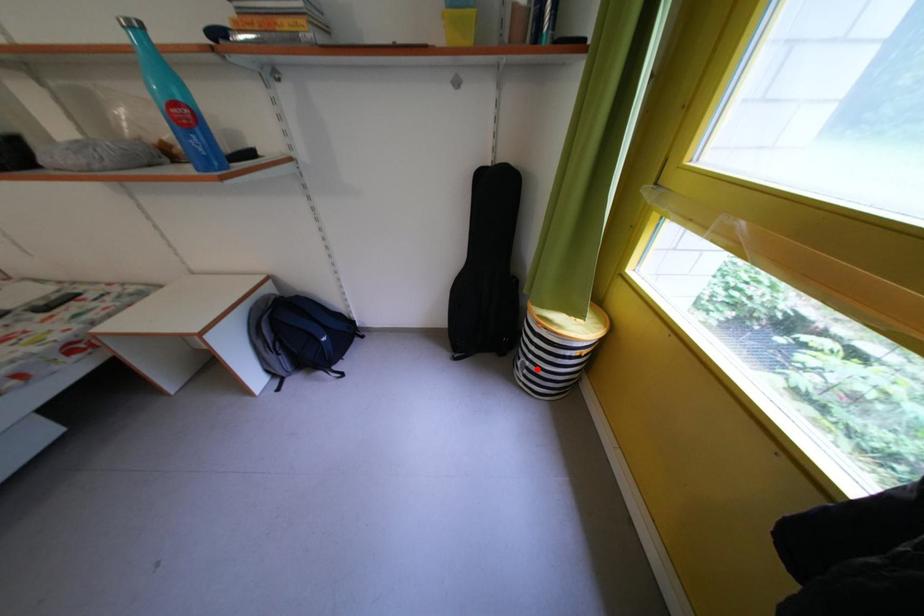
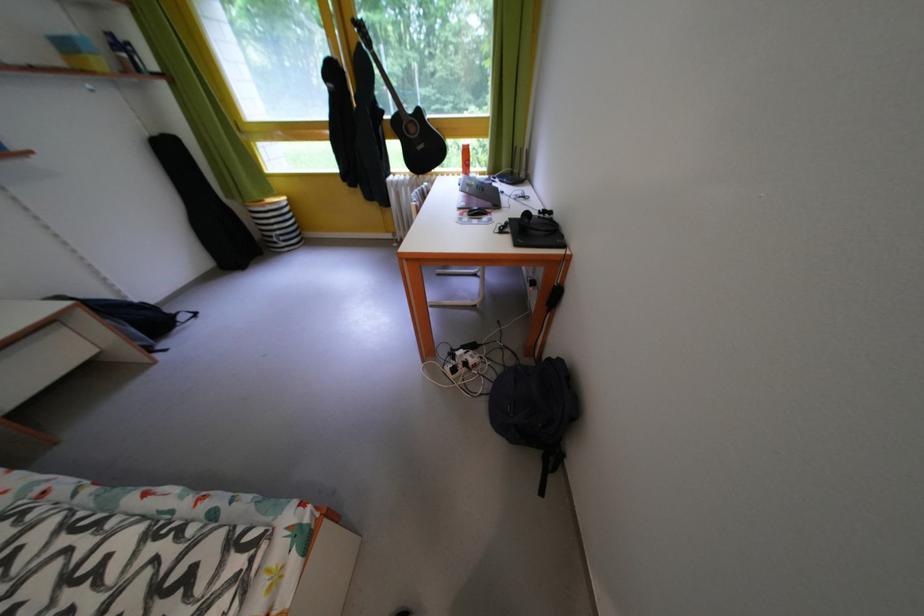
Question: I am providing you with two images of the same scene from different viewpoints. Given a red point in image1, look at the same physical point in image2. Is it:

Choices:
 (A) Closer to the viewpoint
 (B) Farther from the viewpoint

Answer: (B)